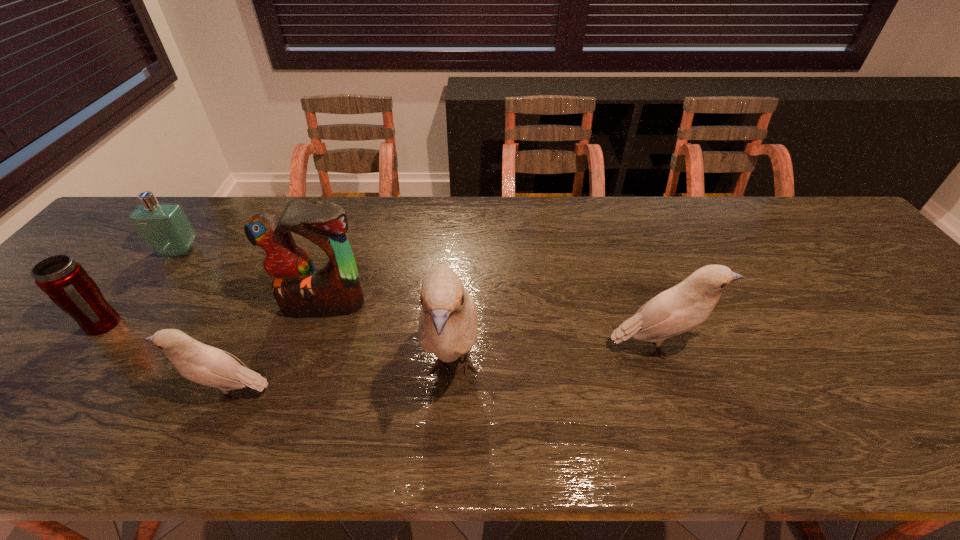
This screenshot has width=960, height=540. In order to click on the leftmost bird in this screenshot , I will do `click(203, 364)`.

Where is `the second bird from right to left`? the second bird from right to left is located at coordinates (448, 323).

Where is `the tallest bird`? the tallest bird is located at coordinates (448, 323).

Locate an element on the screen. The image size is (960, 540). the second tallest bird is located at coordinates (685, 306).

Find the location of a particular element. The image size is (960, 540). the third tallest object is located at coordinates (685, 306).

Identify the location of the farthest object. This screenshot has height=540, width=960. (165, 228).

Find the location of a particular element. thermos bottle is located at coordinates (64, 280).

Find the location of a particular element. The height and width of the screenshot is (540, 960). parrot is located at coordinates point(300,290).

At what (x,y) coordinates should I click in order to perform the action: click on free space located at the beak of the shortest bird. Please return your answer as a coordinate pair (x, y). Image resolution: width=960 pixels, height=540 pixels. Looking at the image, I should click on (83, 393).

This screenshot has width=960, height=540. What are the coordinates of `blank space located at the beak of the shortest bird` in the screenshot? It's located at (12, 393).